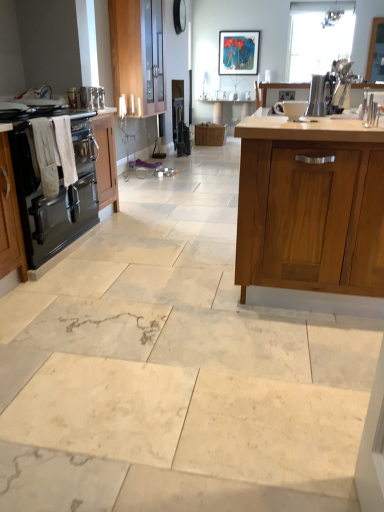
Question: From their relative heights in the image, would you say white cotton towel at left is taller or shorter than metallic silver kettle at upper left, the 3th appliance viewed from the front?

Choices:
 (A) short
 (B) tall

Answer: (B)

Question: From a real-world perspective, relative to metallic silver kettle at upper left, arranged as the second appliance when viewed from the back, is white cotton towel at left vertically above or below?

Choices:
 (A) above
 (B) below

Answer: (B)

Question: Estimate the real-world distances between objects in this image. Which object is closer to the clear glass window screen at upper right?

Choices:
 (A) satin silver toaster at center, the 1th appliance when ordered from top to bottom
 (B) matte plastic picture frame at upper center
 (C) wooden cabinet at upper left, which is counted as the 2th cabinetry, starting from the left
 (D) wooden cabinet at center, the 3th cabinetry when ordered from left to right
 (E) wooden table at center

Answer: (B)

Question: Estimate the real-world distances between objects in this image. Which object is farther from the clear glass window screen at upper right?

Choices:
 (A) satin silver toaster at upper right, the 2th appliance in the front-to-back sequence
 (B) matte plastic picture frame at upper center
 (C) wooden cabinet at upper left, the second cabinetry when ordered from right to left
 (D) wooden cabinet at center, the 3th cabinetry when ordered from left to right
 (E) white glossy bowl at upper center, arranged as the 3th appliance when viewed from the right

Answer: (D)